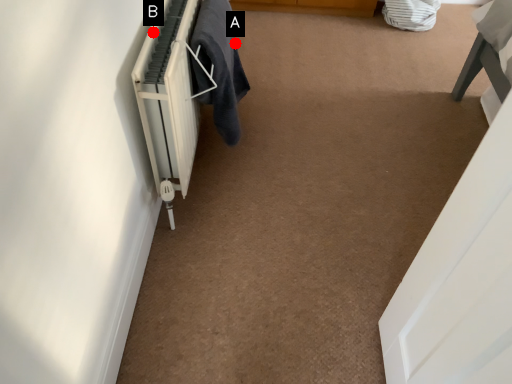
Question: Two points are circled on the image, labeled by A and B beside each circle. Which point appears farthest from the camera in this image?

Choices:
 (A) A is further
 (B) B is further

Answer: (A)